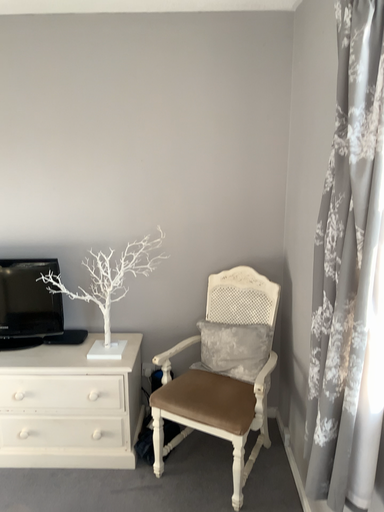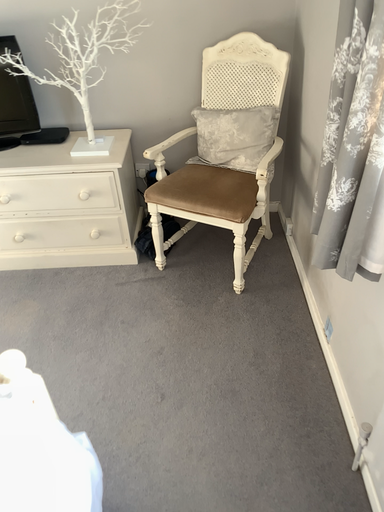
Question: Which way did the camera rotate in the video?

Choices:
 (A) rotated downward
 (B) rotated upward

Answer: (A)